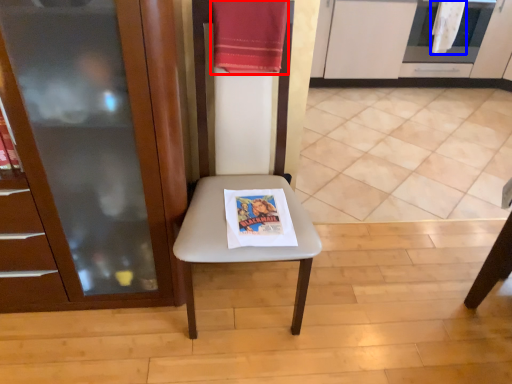
Question: Which object is closer to the camera taking this photo, beach towel (highlighted by a red box) or beach towel (highlighted by a blue box)?

Choices:
 (A) beach towel
 (B) beach towel

Answer: (A)